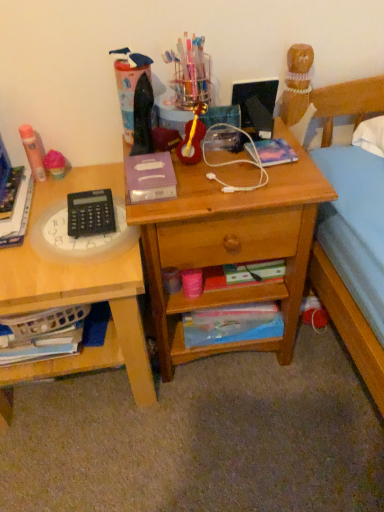
The width and height of the screenshot is (384, 512). In order to click on free point in front of black plastic calculator at left in this screenshot , I will do `click(62, 274)`.